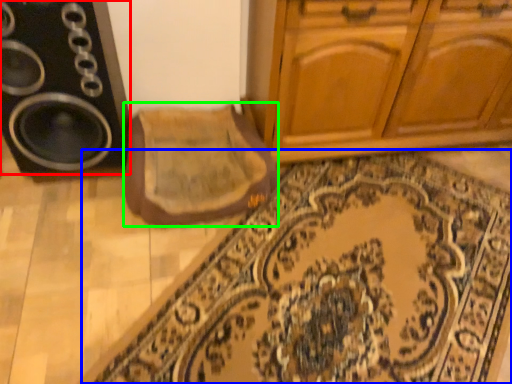
Question: Based on their relative distances, which object is nearer to speaker (highlighted by a red box)? Choose from doormat (highlighted by a blue box) and mat (highlighted by a green box).

Choices:
 (A) doormat
 (B) mat

Answer: (B)